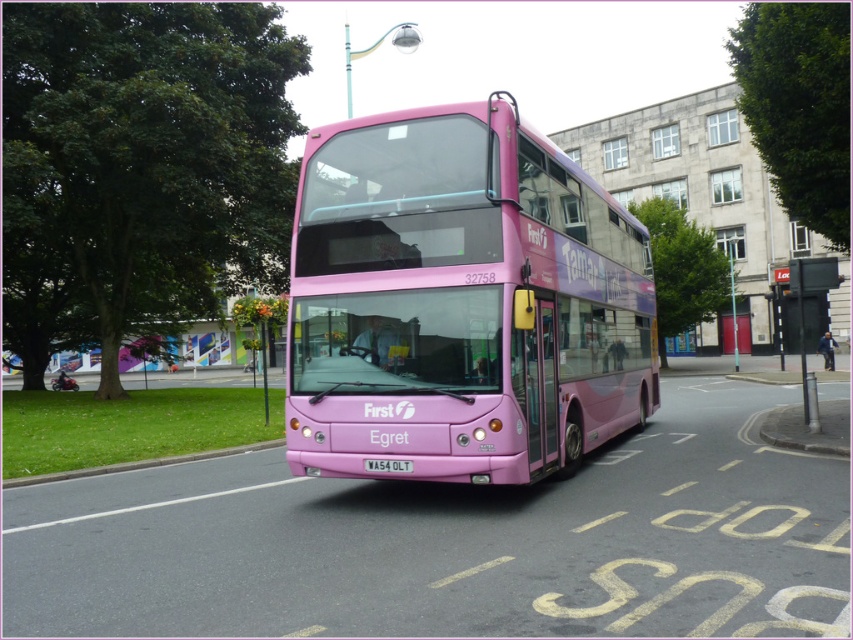
Who is higher up, green grass at lower left or white plastic license plate at center?

white plastic license plate at center

Is green grass at lower left bigger than white plastic license plate at center?

Indeed, green grass at lower left has a larger size compared to white plastic license plate at center.

Who is more distant from viewer, (253, 445) or (398, 465)?

The point (253, 445) is more distant.

Identify the location of green grass at lower left. The height and width of the screenshot is (640, 853). (137, 465).

Is pink matte bus at center smaller than green grass at lower left?

Actually, pink matte bus at center might be larger than green grass at lower left.

Does pink matte bus at center come behind green grass at lower left?

No, pink matte bus at center is in front of green grass at lower left.

The image size is (853, 640). Find the location of `pink matte bus at center`. pink matte bus at center is located at coordinates (461, 301).

The image size is (853, 640). What are the coordinates of `pink matte bus at center` in the screenshot? It's located at (461, 301).

Based on the photo, who is shorter, pink matte bus at center or white plastic license plate at center?

Standing shorter between the two is white plastic license plate at center.

Between point (323, 289) and point (410, 461), which one is positioned behind?

Point (323, 289)

Between point (631, 394) and point (368, 467), which one is positioned behind?

Positioned behind is point (631, 394).

Identify the location of pink matte bus at center. The width and height of the screenshot is (853, 640). (461, 301).